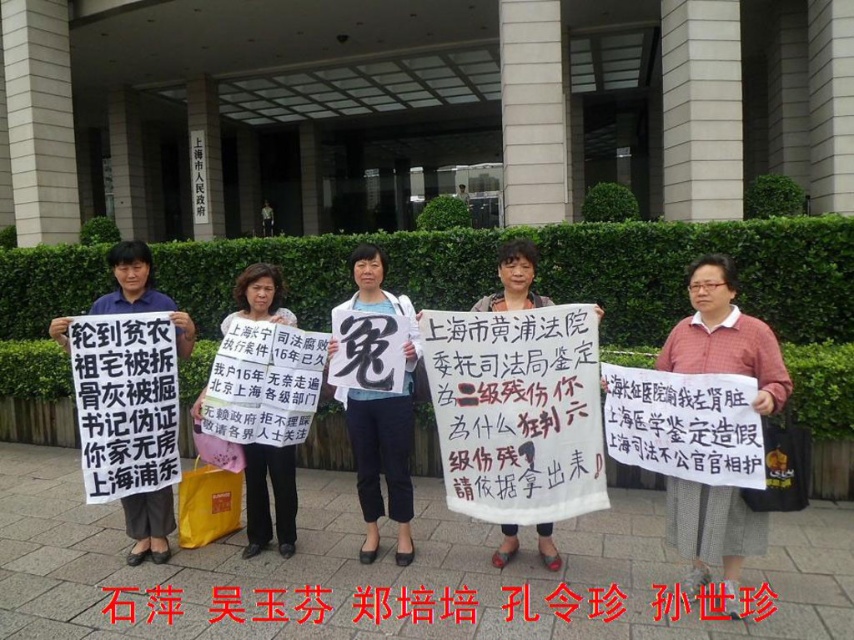
Question: Is black paper at center above pink fabric sign at center?

Choices:
 (A) yes
 (B) no

Answer: (B)

Question: Is white paper sign at center in front of white paper sign at left?

Choices:
 (A) yes
 (B) no

Answer: (A)

Question: Which point is closer to the camera?

Choices:
 (A) pink checkered shirt at center
 (B) white paper sign at center
 (C) pink fabric sign at center

Answer: (A)

Question: Among these objects, which one is nearest to the camera?

Choices:
 (A) pink fabric sign at center
 (B) white paper sign at left
 (C) pink checkered shirt at center

Answer: (C)

Question: Is black paper at center closer to camera compared to white paper sign at center?

Choices:
 (A) no
 (B) yes

Answer: (B)

Question: Which object is closer to the camera taking this photo?

Choices:
 (A) white paper sign at center
 (B) pink checkered shirt at center
 (C) pink fabric sign at center

Answer: (B)